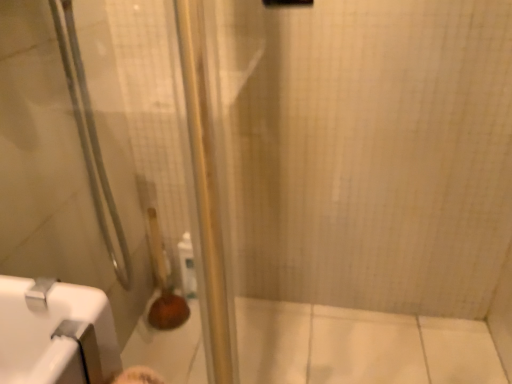
The height and width of the screenshot is (384, 512). Describe the element at coordinates (64, 159) in the screenshot. I see `clear glass shower door at left` at that location.

Where is `clear glass shower door at left`? This screenshot has height=384, width=512. clear glass shower door at left is located at coordinates (64, 159).

The height and width of the screenshot is (384, 512). Identify the location of clear glass shower door at left. (64, 159).